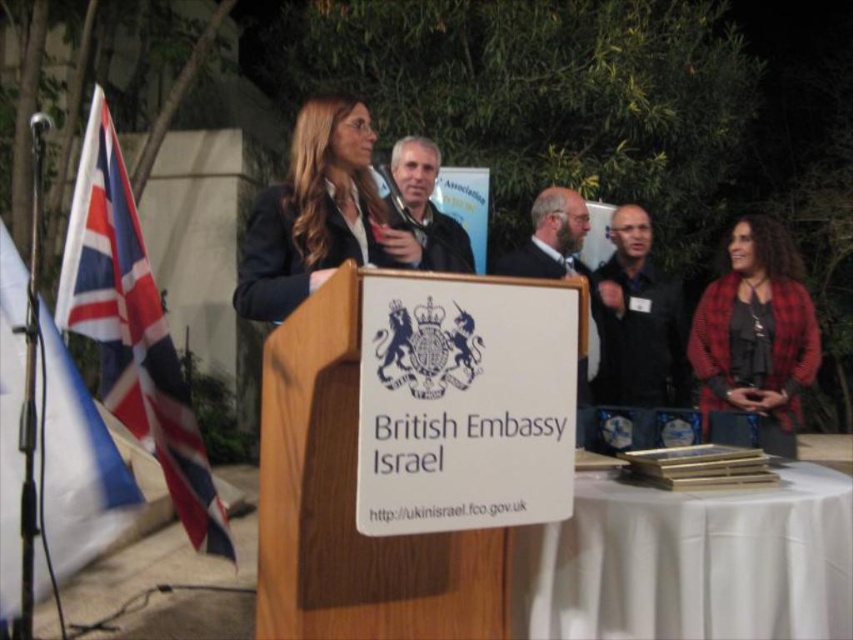
Question: Which of the following is the farthest from the observer?

Choices:
 (A) black leather jacket at center
 (B) matte black jacket at center
 (C) matte black blazer at center
 (D) red plaid shirt at right

Answer: (A)

Question: Can you confirm if red-white-blue fabric flag at left is positioned to the left of matte black blazer at center?

Choices:
 (A) yes
 (B) no

Answer: (A)

Question: Is red-white-blue fabric flag at left to the right of black leather jacket at center from the viewer's perspective?

Choices:
 (A) no
 (B) yes

Answer: (A)

Question: Which point is farther to the camera?

Choices:
 (A) (421, 173)
 (B) (322, 152)
 (C) (726, 387)

Answer: (C)

Question: Estimate the real-world distances between objects in this image. Which object is closer to the matte black jacket at center?

Choices:
 (A) black leather jacket at center
 (B) red plaid shirt at right
 (C) red-white-blue fabric flag at left

Answer: (C)

Question: Is red-white-blue fabric flag at left to the left of black leather jacket at center from the viewer's perspective?

Choices:
 (A) no
 (B) yes

Answer: (B)